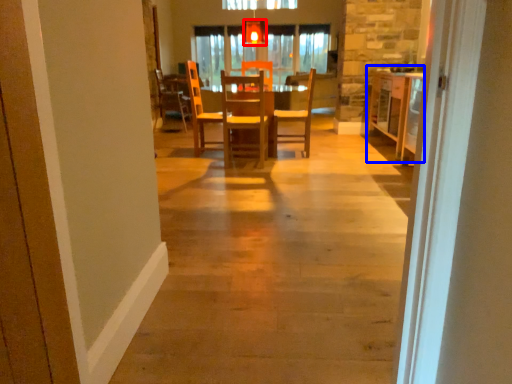
Question: Which of the following is the closest to the observer, light fixture (highlighted by a red box) or table (highlighted by a blue box)?

Choices:
 (A) light fixture
 (B) table

Answer: (B)